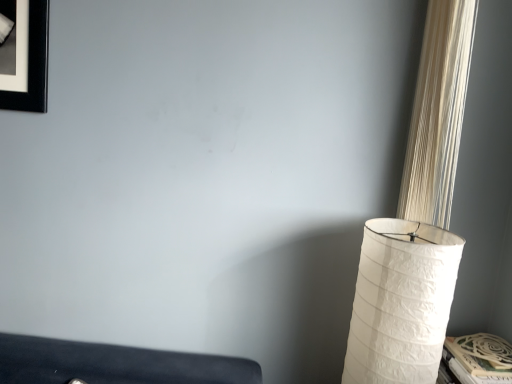
Question: From the image's perspective, is white textured lampshade at right below white textured curtain at right?

Choices:
 (A) no
 (B) yes

Answer: (B)

Question: From a real-world perspective, is white textured lampshade at right physically above white textured curtain at right?

Choices:
 (A) no
 (B) yes

Answer: (A)

Question: Is white textured lampshade at right next to white textured curtain at right and touching it?

Choices:
 (A) yes
 (B) no

Answer: (B)

Question: Is white textured curtain at right completely or partially inside white textured lampshade at right?

Choices:
 (A) no
 (B) yes

Answer: (A)

Question: Is white textured lampshade at right to the right of white textured curtain at right from the viewer's perspective?

Choices:
 (A) no
 (B) yes

Answer: (A)

Question: From a real-world perspective, does white textured lampshade at right sit lower than white textured curtain at right?

Choices:
 (A) no
 (B) yes

Answer: (B)

Question: Can we say white textured curtain at right lies outside white textured lampshade at right?

Choices:
 (A) no
 (B) yes

Answer: (B)

Question: Can you confirm if white textured curtain at right is bigger than white textured lampshade at right?

Choices:
 (A) no
 (B) yes

Answer: (A)

Question: Considering the relative sizes of white textured curtain at right and white textured lampshade at right in the image provided, is white textured curtain at right taller than white textured lampshade at right?

Choices:
 (A) yes
 (B) no

Answer: (A)

Question: Considering the relative sizes of white textured curtain at right and white textured lampshade at right in the image provided, is white textured curtain at right smaller than white textured lampshade at right?

Choices:
 (A) yes
 (B) no

Answer: (A)

Question: From a real-world perspective, is white textured curtain at right located higher than white textured lampshade at right?

Choices:
 (A) yes
 (B) no

Answer: (A)

Question: Is white textured curtain at right directly adjacent to white textured lampshade at right?

Choices:
 (A) yes
 (B) no

Answer: (B)

Question: From the image's perspective, is white textured curtain at right located above or below white textured lampshade at right?

Choices:
 (A) below
 (B) above

Answer: (B)